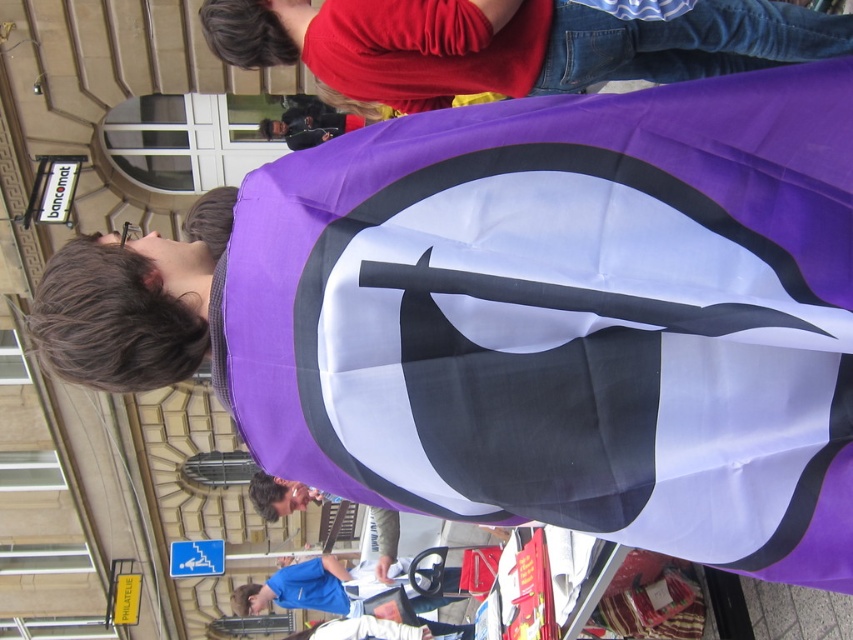
Between purple fabric flag at center and purple fabric at upper center, which one is positioned lower?

Positioned lower is purple fabric flag at center.

Who is more forward, (341, 476) or (329, 20)?

Positioned in front is point (341, 476).

I want to click on purple fabric flag at center, so click(569, 317).